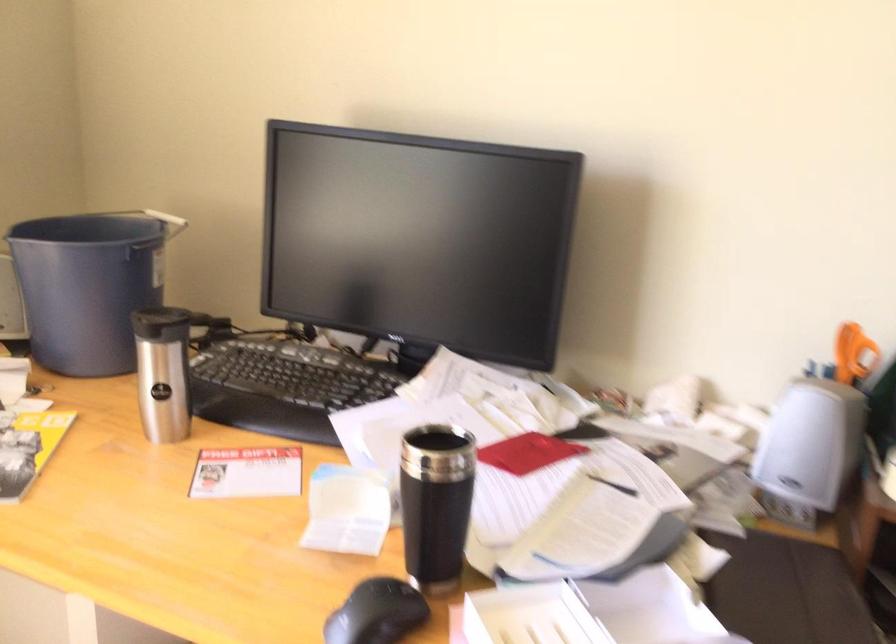
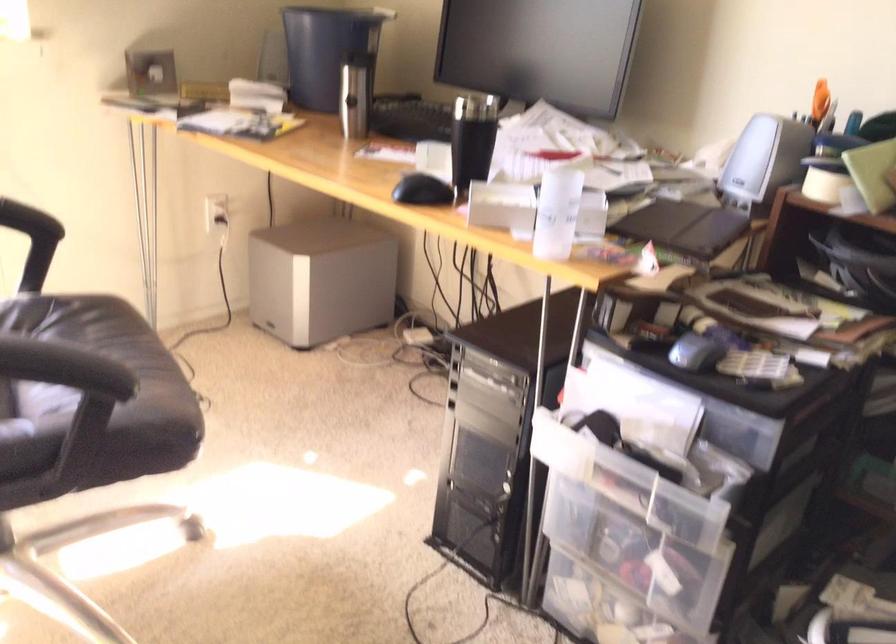
Which direction would the cameraman need to move to produce the second image?

The cameraman walked toward right, backward.